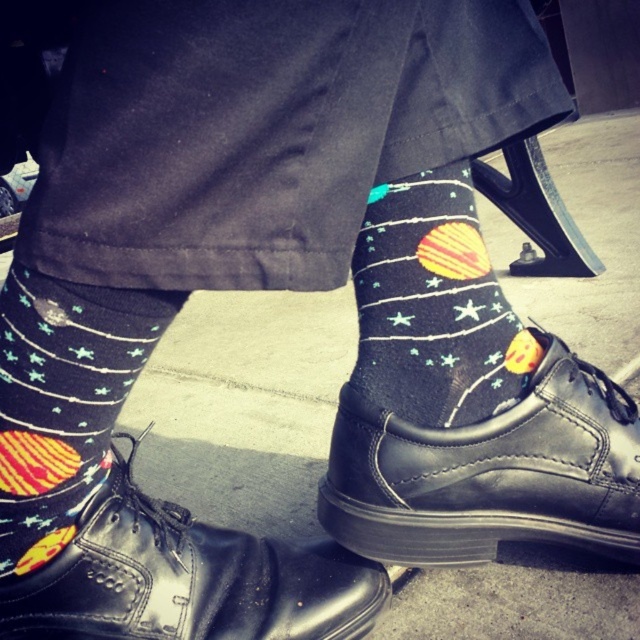
Measure the distance between black leather shoe at center and camera.

A distance of 21.88 inches exists between black leather shoe at center and camera.

Who is taller, black leather shoe at center or matte black socks with space design at lower left?

With more height is matte black socks with space design at lower left.

What do you see at coordinates (490, 472) in the screenshot? The width and height of the screenshot is (640, 640). I see `black leather shoe at center` at bounding box center [490, 472].

Image resolution: width=640 pixels, height=640 pixels. Identify the location of black leather shoe at center. (490, 472).

Does space-themed socks at center have a larger size compared to matte black socks with space design at lower left?

Actually, space-themed socks at center might be smaller than matte black socks with space design at lower left.

Is space-themed socks at center positioned before matte black socks with space design at lower left?

No, space-themed socks at center is further to the viewer.

Is point (355, 374) more distant than point (84, 305)?

Yes.

The height and width of the screenshot is (640, 640). Identify the location of space-themed socks at center. (435, 307).

Who is lower down, black leather shoe at center or black leather shoe at lower center?

black leather shoe at lower center is below.

Can you confirm if black leather shoe at center is positioned to the left of black leather shoe at lower center?

No, black leather shoe at center is not to the left of black leather shoe at lower center.

Is point (397, 456) in front of point (252, 552)?

Yes, point (397, 456) is in front of point (252, 552).

At what (x,y) coordinates should I click in order to perform the action: click on black leather shoe at center. Please return your answer as a coordinate pair (x, y). The height and width of the screenshot is (640, 640). Looking at the image, I should click on (490, 472).